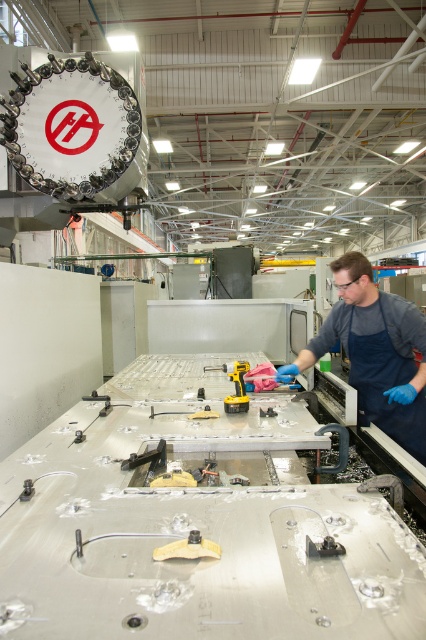
You are an inspector in the industrial workspace and need to determine which item is taller between the blue rubber gloves at right and the dark blue fabric apron at right. Based on the scene, which one is taller?

The blue rubber gloves at right is taller than the dark blue fabric apron at right according to the description.

You are an inspector checking the workspace layout. You notice the dark blue fabric apron at right and the metallic gray tool at center. Which object is positioned higher in the image?

The dark blue fabric apron at right is located above the metallic gray tool at center, so it is positioned higher in the image.

You are an inspector in the factory and need to determine if the dark blue fabric apron at right can cover the metallic gray tool at center completely. Based on their sizes, can the apron cover the tool?

The dark blue fabric apron at right is wider than the metallic gray tool at center, so yes, the apron can cover the tool completely.